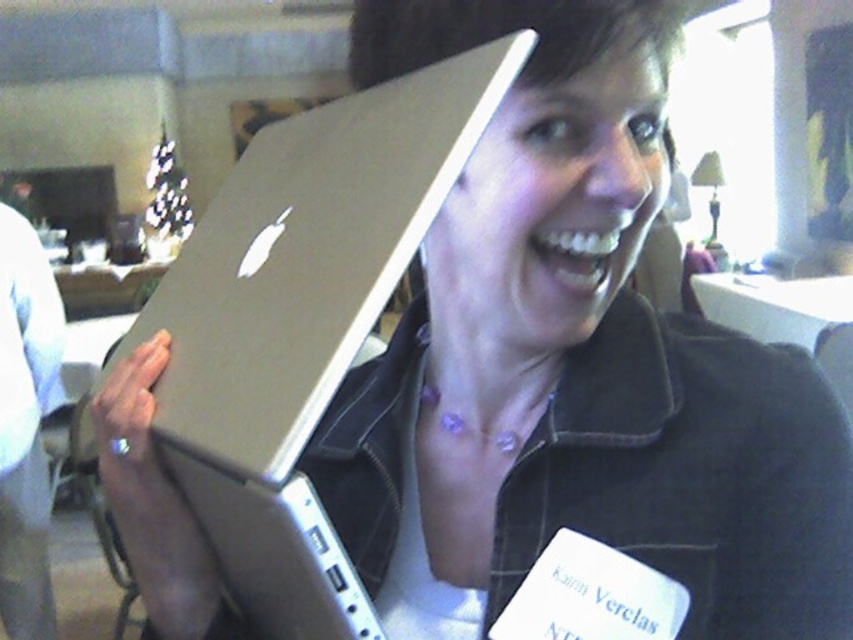
You are a photographer trying to capture a closeup of the silver metallic laptop at center. Given that your camera has a focal length of 50mm and you are currently 2 meters away from the laptop, can you estimate whether you need to move closer or farther away to focus properly?

The silver metallic laptop at center is positioned at coordinates point (305, 266). However, without knowing the camera sensor size or the desired field of view, it is impossible to determine the exact distance adjustment needed for proper focus.

You are organizing a tech fair and need to arrange these two laptops on a shelf. The silver metallic laptop at center and the brushed metal laptop at left must be placed side by side. Which one should you place on the left side to ensure they fit within the shelf width of 1.2 meters?

The silver metallic laptop at center is shorter than the brushed metal laptop at left. To fit them within the 1.2 meters shelf width, place the shorter silver metallic laptop at center on the left side and the longer brushed metal laptop at left next to it, ensuring both fit together within the available space.

You are organizing a tech fair and need to arrange two laptops on a small table. The silver metallic laptop at center and the brushed metal laptop at left are both to be placed there. Based on their sizes, which one should you place first to ensure they both fit?

The silver metallic laptop at center occupies less space than the brushed metal laptop at left, so you should place the brushed metal laptop at left first to ensure both fit on the small table.